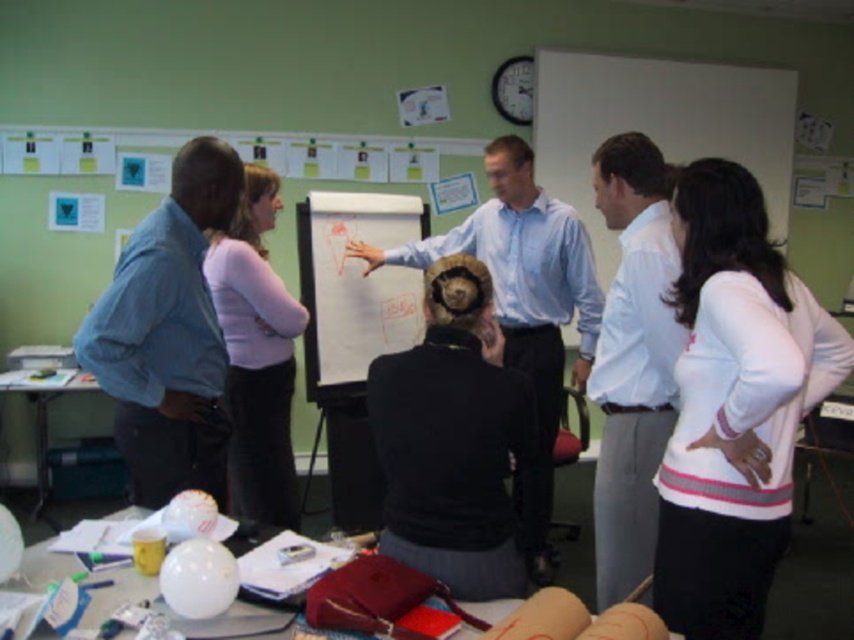
Does white sweater at right come behind white shirt at right?

No, white sweater at right is in front of white shirt at right.

You are a GUI agent. You are given a task and a screenshot of the screen. Output one action in this format:
    pyautogui.click(x=<x>, y=<y>)
    Task: Click on the white sweater at right
    The image size is (854, 640).
    Given the screenshot: What is the action you would take?
    pyautogui.click(x=734, y=406)

Can you confirm if blue striped shirt at left is positioned below whiteboard at center?

Yes, blue striped shirt at left is below whiteboard at center.

Can you confirm if blue striped shirt at left is positioned to the right of whiteboard at center?

Incorrect, blue striped shirt at left is not on the right side of whiteboard at center.

Does point (179, 243) come behind point (329, 289)?

No, (179, 243) is in front of (329, 289).

Image resolution: width=854 pixels, height=640 pixels. In order to click on blue striped shirt at left in this screenshot , I will do `click(168, 333)`.

Is white sweater at right positioned in front of whiteboard at center?

Yes, it is.

Who is more forward, (723,262) or (314,381)?

Point (723,262) is more forward.

Image resolution: width=854 pixels, height=640 pixels. Describe the element at coordinates (734, 406) in the screenshot. I see `white sweater at right` at that location.

Image resolution: width=854 pixels, height=640 pixels. In order to click on white sweater at right in this screenshot , I will do `click(734, 406)`.